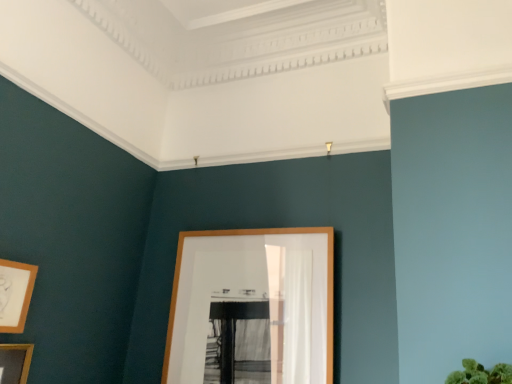
The width and height of the screenshot is (512, 384). What do you see at coordinates (15, 294) in the screenshot?
I see `wooden picture frame at lower left, which ranks as the 2th picture frame in left-to-right order` at bounding box center [15, 294].

Find the location of a particular element. The image size is (512, 384). wooden picture frame at lower left, which ranks as the 1th picture frame in left-to-right order is located at coordinates (15, 362).

Image resolution: width=512 pixels, height=384 pixels. I want to click on wooden picture frame at lower left, which ranks as the 2th picture frame in left-to-right order, so click(x=15, y=294).

Does point (27, 351) come farther from viewer compared to point (193, 373)?

No, (27, 351) is in front of (193, 373).

Considering the relative sizes of wooden picture frame at lower left, acting as the 3th picture frame starting from the right, and wooden picture frame at center, the 1th picture frame positioned from the right, in the image provided, is wooden picture frame at lower left, acting as the 3th picture frame starting from the right, smaller than wooden picture frame at center, the 1th picture frame positioned from the right,?

Yes, wooden picture frame at lower left, acting as the 3th picture frame starting from the right, is smaller than wooden picture frame at center, the 1th picture frame positioned from the right.

Considering the positions of objects wooden picture frame at lower left, acting as the 3th picture frame starting from the right, and wooden picture frame at center, the 1th picture frame positioned from the right, in the image provided, who is behind, wooden picture frame at lower left, acting as the 3th picture frame starting from the right, or wooden picture frame at center, the 1th picture frame positioned from the right,?

wooden picture frame at center, the 1th picture frame positioned from the right, is further from the camera.

Does wooden picture frame at lower left, acting as the 3th picture frame starting from the right, have a greater width compared to wooden picture frame at center, positioned as the third picture frame in left-to-right order?

Incorrect, the width of wooden picture frame at lower left, acting as the 3th picture frame starting from the right, does not surpass that of wooden picture frame at center, positioned as the third picture frame in left-to-right order.

Which is behind, point (14, 377) or point (20, 275)?

The point (20, 275) is more distant.

Looking at this image, from a real-world perspective, is wooden picture frame at lower left, acting as the 3th picture frame starting from the right, below wooden picture frame at lower left, the 2th picture frame when ordered from right to left?

Correct, in the physical world, wooden picture frame at lower left, acting as the 3th picture frame starting from the right, is lower than wooden picture frame at lower left, the 2th picture frame when ordered from right to left.

Which object is thinner, wooden picture frame at lower left, acting as the 3th picture frame starting from the right, or wooden picture frame at lower left, which ranks as the 2th picture frame in left-to-right order?

With smaller width is wooden picture frame at lower left, acting as the 3th picture frame starting from the right.

Can you confirm if wooden picture frame at lower left, which ranks as the 2th picture frame in left-to-right order, is taller than wooden picture frame at lower left, which ranks as the 1th picture frame in left-to-right order?

In fact, wooden picture frame at lower left, which ranks as the 2th picture frame in left-to-right order, may be shorter than wooden picture frame at lower left, which ranks as the 1th picture frame in left-to-right order.

Considering the relative sizes of wooden picture frame at lower left, the 2th picture frame when ordered from right to left, and wooden picture frame at lower left, acting as the 3th picture frame starting from the right, in the image provided, is wooden picture frame at lower left, the 2th picture frame when ordered from right to left, bigger than wooden picture frame at lower left, acting as the 3th picture frame starting from the right,?

No.

Considering the relative positions of wooden picture frame at lower left, the 2th picture frame when ordered from right to left, and wooden picture frame at lower left, which ranks as the 1th picture frame in left-to-right order, in the image provided, is wooden picture frame at lower left, the 2th picture frame when ordered from right to left, behind wooden picture frame at lower left, which ranks as the 1th picture frame in left-to-right order,?

That is True.

From a real-world perspective, who is located lower, wooden picture frame at lower left, which ranks as the 2th picture frame in left-to-right order, or wooden picture frame at lower left, which ranks as the 1th picture frame in left-to-right order?

From a 3D spatial view, wooden picture frame at lower left, which ranks as the 1th picture frame in left-to-right order, is below.

Who is more distant, wooden picture frame at center, the 1th picture frame positioned from the right, or wooden picture frame at lower left, acting as the 3th picture frame starting from the right?

wooden picture frame at center, the 1th picture frame positioned from the right, is further from the camera.

Considering the sizes of objects wooden picture frame at center, positioned as the third picture frame in left-to-right order, and wooden picture frame at lower left, which ranks as the 1th picture frame in left-to-right order, in the image provided, who is shorter, wooden picture frame at center, positioned as the third picture frame in left-to-right order, or wooden picture frame at lower left, which ranks as the 1th picture frame in left-to-right order,?

wooden picture frame at lower left, which ranks as the 1th picture frame in left-to-right order, is shorter.

Is wooden picture frame at center, positioned as the third picture frame in left-to-right order, next to wooden picture frame at lower left, acting as the 3th picture frame starting from the right, and touching it?

No, wooden picture frame at center, positioned as the third picture frame in left-to-right order, is not beside wooden picture frame at lower left, acting as the 3th picture frame starting from the right.

Find the location of a particular element. This screenshot has height=384, width=512. picture frame that is the 1st object directly below the wooden picture frame at center, positioned as the third picture frame in left-to-right order (from a real-world perspective) is located at coordinates (15, 294).

In terms of height, does wooden picture frame at center, positioned as the third picture frame in left-to-right order, look taller or shorter compared to wooden picture frame at lower left, the 2th picture frame when ordered from right to left?

In the image, wooden picture frame at center, positioned as the third picture frame in left-to-right order, appears to be taller than wooden picture frame at lower left, the 2th picture frame when ordered from right to left.

From the image's perspective, does wooden picture frame at center, positioned as the third picture frame in left-to-right order, appear lower than wooden picture frame at lower left, the 2th picture frame when ordered from right to left?

Yes, from the image's perspective, wooden picture frame at center, positioned as the third picture frame in left-to-right order, is beneath wooden picture frame at lower left, the 2th picture frame when ordered from right to left.

Is wooden picture frame at center, the 1th picture frame positioned from the right, not inside wooden picture frame at lower left, which ranks as the 2th picture frame in left-to-right order?

Absolutely, wooden picture frame at center, the 1th picture frame positioned from the right, is external to wooden picture frame at lower left, which ranks as the 2th picture frame in left-to-right order.

Does wooden picture frame at lower left, which ranks as the 2th picture frame in left-to-right order, have a lesser height compared to wooden picture frame at center, positioned as the third picture frame in left-to-right order?

Yes.

Is wooden picture frame at lower left, the 2th picture frame when ordered from right to left, to the left of wooden picture frame at center, positioned as the third picture frame in left-to-right order, from the viewer's perspective?

Yes, wooden picture frame at lower left, the 2th picture frame when ordered from right to left, is to the left of wooden picture frame at center, positioned as the third picture frame in left-to-right order.

Is wooden picture frame at lower left, the 2th picture frame when ordered from right to left, thinner than wooden picture frame at center, the 1th picture frame positioned from the right?

Correct, the width of wooden picture frame at lower left, the 2th picture frame when ordered from right to left, is less than that of wooden picture frame at center, the 1th picture frame positioned from the right.

You are a GUI agent. You are given a task and a screenshot of the screen. Output one action in this format:
    pyautogui.click(x=<x>, y=<y>)
    Task: Click on the picture frame lying behind the wooden picture frame at lower left, the 2th picture frame when ordered from right to left
    
    Given the screenshot: What is the action you would take?
    pyautogui.click(x=254, y=301)

From a real-world perspective, starting from the wooden picture frame at center, positioned as the third picture frame in left-to-right order, which picture frame is the 2nd one below it? Please provide its 2D coordinates.

[(15, 362)]

Identify the location of picture frame that is the 1st one when counting backward from the wooden picture frame at lower left, which ranks as the 1th picture frame in left-to-right order. (15, 294).

Based on their spatial positions, is wooden picture frame at lower left, the 2th picture frame when ordered from right to left, or wooden picture frame at lower left, which ranks as the 1th picture frame in left-to-right order, closer to wooden picture frame at center, the 1th picture frame positioned from the right?

wooden picture frame at lower left, the 2th picture frame when ordered from right to left, is positioned closer to the anchor wooden picture frame at center, the 1th picture frame positioned from the right.

Looking at the image, which one is located further to wooden picture frame at center, positioned as the third picture frame in left-to-right order, wooden picture frame at lower left, which ranks as the 1th picture frame in left-to-right order, or wooden picture frame at lower left, which ranks as the 2th picture frame in left-to-right order?

wooden picture frame at lower left, which ranks as the 1th picture frame in left-to-right order, lies further to wooden picture frame at center, positioned as the third picture frame in left-to-right order, than the other object.

From the image, which object appears to be nearer to wooden picture frame at lower left, acting as the 3th picture frame starting from the right, wooden picture frame at lower left, the 2th picture frame when ordered from right to left, or wooden picture frame at center, positioned as the third picture frame in left-to-right order?

wooden picture frame at lower left, the 2th picture frame when ordered from right to left, is positioned closer to the anchor wooden picture frame at lower left, acting as the 3th picture frame starting from the right.

Estimate the real-world distances between objects in this image. Which object is closer to wooden picture frame at lower left, which ranks as the 2th picture frame in left-to-right order, wooden picture frame at center, the 1th picture frame positioned from the right, or wooden picture frame at lower left, acting as the 3th picture frame starting from the right?

Based on the image, wooden picture frame at lower left, acting as the 3th picture frame starting from the right, appears to be nearer to wooden picture frame at lower left, which ranks as the 2th picture frame in left-to-right order.

Which object lies nearer to the anchor point wooden picture frame at lower left, which ranks as the 2th picture frame in left-to-right order, wooden picture frame at lower left, which ranks as the 1th picture frame in left-to-right order, or wooden picture frame at center, the 1th picture frame positioned from the right?

Among the two, wooden picture frame at lower left, which ranks as the 1th picture frame in left-to-right order, is located nearer to wooden picture frame at lower left, which ranks as the 2th picture frame in left-to-right order.

Looking at the image, which one is located further to wooden picture frame at lower left, acting as the 3th picture frame starting from the right, wooden picture frame at center, positioned as the third picture frame in left-to-right order, or wooden picture frame at lower left, the 2th picture frame when ordered from right to left?

wooden picture frame at center, positioned as the third picture frame in left-to-right order.

Identify the location of picture frame between wooden picture frame at lower left, acting as the 3th picture frame starting from the right, and wooden picture frame at center, the 1th picture frame positioned from the right, in the horizontal direction. (15, 294).